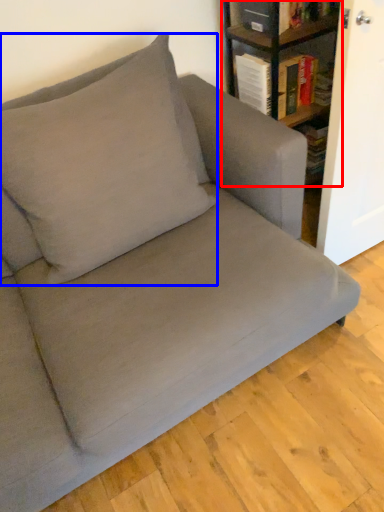
Question: Which of the following is the closest to the observer, shelf (highlighted by a red box) or throw pillow (highlighted by a blue box)?

Choices:
 (A) shelf
 (B) throw pillow

Answer: (B)